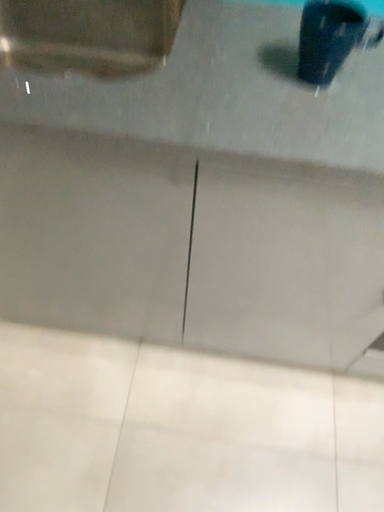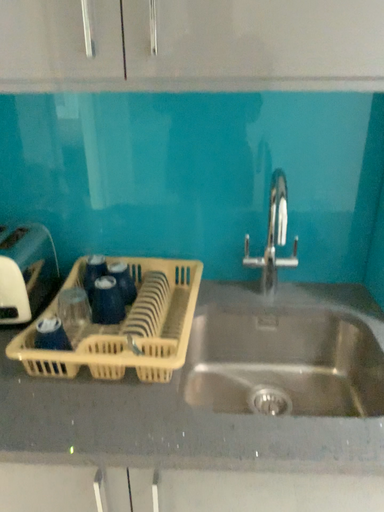
Question: How did the camera likely rotate when shooting the video?

Choices:
 (A) rotated downward
 (B) rotated upward

Answer: (B)